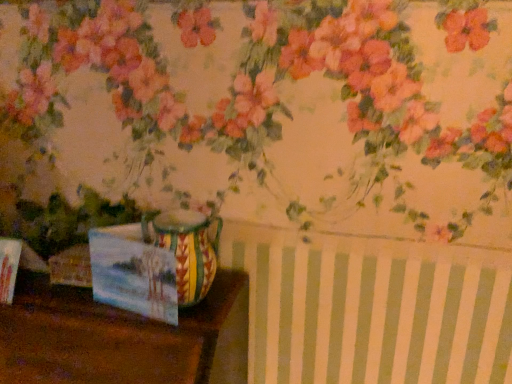
I want to click on vacant space in front of matte paper postcard at lower left, so click(136, 328).